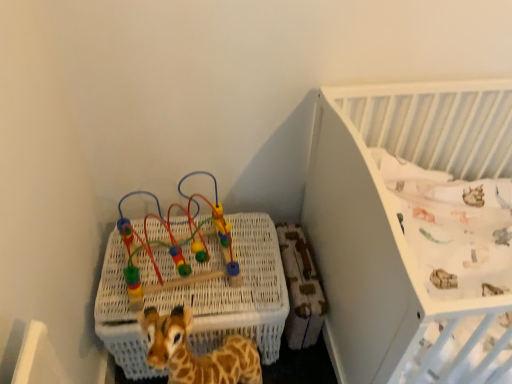
Locate an element on the screen. The image size is (512, 384). vacant region below multicolored plastic bead maze at upper left (from a real-world perspective) is located at coordinates (180, 283).